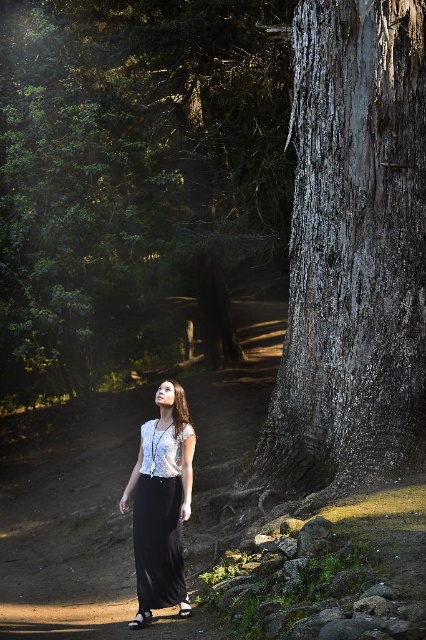
Question: Which point is closer to the camera taking this photo?

Choices:
 (A) (325, 125)
 (B) (187, 493)

Answer: (B)

Question: Does gray textured bark at center appear under white lace blouse at center?

Choices:
 (A) yes
 (B) no

Answer: (B)

Question: Which point is closer to the camera taking this photo?

Choices:
 (A) (308, 209)
 (B) (178, 433)

Answer: (B)

Question: Can you confirm if gray textured bark at center is smaller than white lace blouse at center?

Choices:
 (A) yes
 (B) no

Answer: (B)

Question: Is gray textured bark at center positioned at the back of white lace blouse at center?

Choices:
 (A) yes
 (B) no

Answer: (A)